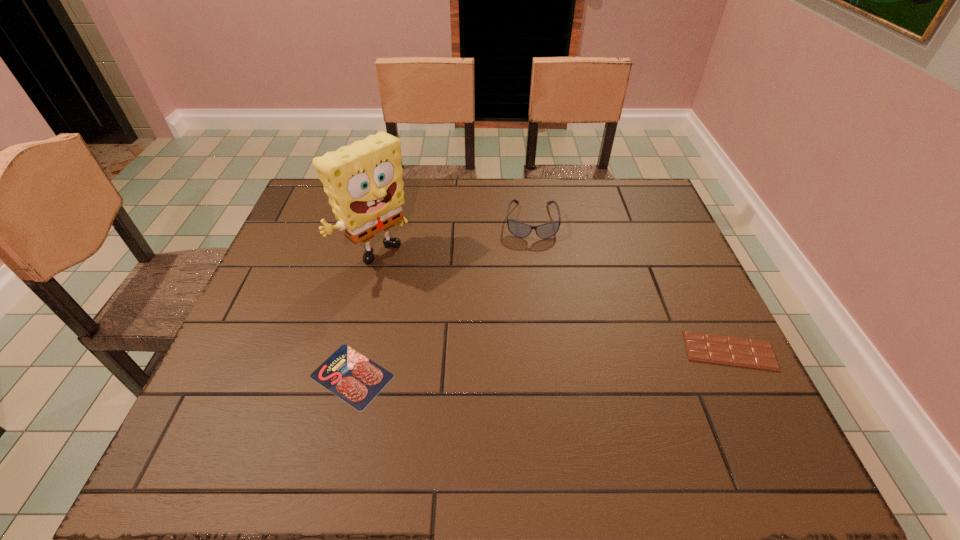
Where is `free space between the rightmost object and the tallest object`? This screenshot has width=960, height=540. free space between the rightmost object and the tallest object is located at coordinates (553, 303).

Where is `blank region between the chocolate bar and the sponge`? blank region between the chocolate bar and the sponge is located at coordinates (553, 303).

The height and width of the screenshot is (540, 960). I want to click on vacant space in between the second object from right to left and the salami, so click(x=442, y=299).

Locate an element on the screen. The width and height of the screenshot is (960, 540). empty location between the sponge and the third object from left to right is located at coordinates (454, 239).

This screenshot has height=540, width=960. What are the coordinates of `object that stands as the closest to the sponge` in the screenshot? It's located at (354, 378).

Select which object appears as the third closest to the rightmost object. Please provide its 2D coordinates. Your answer should be formatted as a tuple, i.e. [(x, y)], where the tuple contains the x and y coordinates of a point satisfying the conditions above.

[(364, 183)]

Find the location of a particular element. This screenshot has width=960, height=540. free space that satisfies the following two spatial constraints: 1. on the front side of the tallest object; 2. on the right side of the chocolate bar is located at coordinates (354, 351).